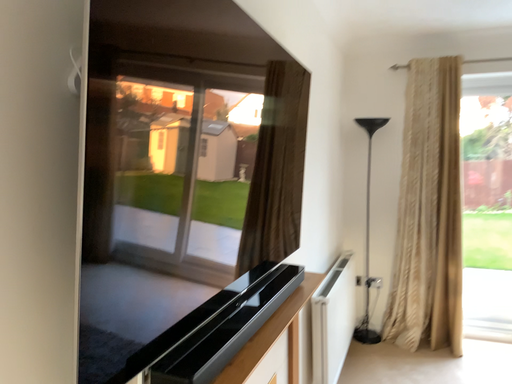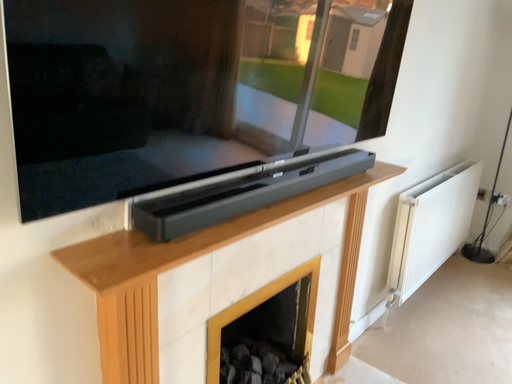
Question: How did the camera likely rotate when shooting the video?

Choices:
 (A) rotated downward
 (B) rotated upward

Answer: (A)